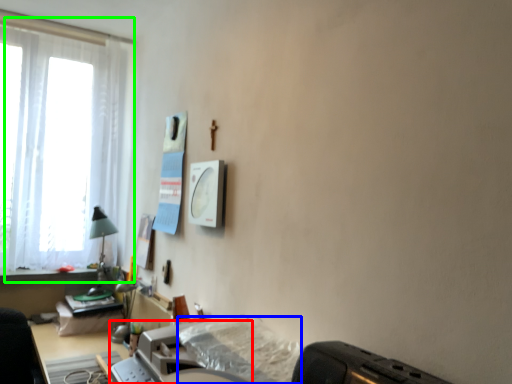
Question: Considering the real-world distances, which object is closest to printer (highlighted by a red box)? sheet (highlighted by a blue box) or window (highlighted by a green box).

Choices:
 (A) sheet
 (B) window

Answer: (A)